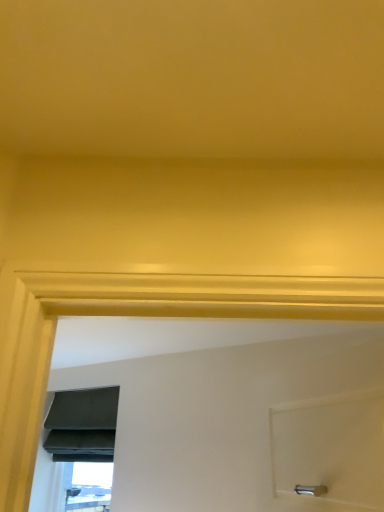
Question: Is matte gray fabric at lower left, which is the 1th window from top to bottom, positioned far away from matte black window at lower left, which is counted as the 2th window, starting from the top?

Choices:
 (A) yes
 (B) no

Answer: (B)

Question: Can you confirm if matte gray fabric at lower left, which is the 1th window from top to bottom, is bigger than matte black window at lower left, which is counted as the 2th window, starting from the top?

Choices:
 (A) yes
 (B) no

Answer: (A)

Question: From the image's perspective, would you say matte gray fabric at lower left, which is the second window from bottom to top, is shown under matte black window at lower left, which is counted as the 2th window, starting from the top?

Choices:
 (A) no
 (B) yes

Answer: (A)

Question: From a real-world perspective, is matte gray fabric at lower left, which is the second window from bottom to top, positioned over matte black window at lower left, the 1th window in the bottom-to-top sequence, based on gravity?

Choices:
 (A) yes
 (B) no

Answer: (A)

Question: Does matte gray fabric at lower left, which is the second window from bottom to top, have a lesser width compared to matte black window at lower left, which is counted as the 2th window, starting from the top?

Choices:
 (A) yes
 (B) no

Answer: (B)

Question: Can you confirm if matte gray fabric at lower left, which is the second window from bottom to top, is positioned to the right of matte black window at lower left, which is counted as the 2th window, starting from the top?

Choices:
 (A) no
 (B) yes

Answer: (A)

Question: Is matte gray fabric at lower left, which is the 1th window from top to bottom, surrounded by matte black window at lower left, the 1th window in the bottom-to-top sequence?

Choices:
 (A) yes
 (B) no

Answer: (B)

Question: Are matte black window at lower left, the 1th window in the bottom-to-top sequence, and matte gray fabric at lower left, which is the 1th window from top to bottom, beside each other?

Choices:
 (A) yes
 (B) no

Answer: (B)

Question: From a real-world perspective, is matte black window at lower left, which is counted as the 2th window, starting from the top, physically below matte gray fabric at lower left, which is the 1th window from top to bottom?

Choices:
 (A) no
 (B) yes

Answer: (B)

Question: Is matte black window at lower left, which is counted as the 2th window, starting from the top, further to camera compared to matte gray fabric at lower left, which is the 1th window from top to bottom?

Choices:
 (A) yes
 (B) no

Answer: (A)

Question: Does matte black window at lower left, the 1th window in the bottom-to-top sequence, have a larger size compared to matte gray fabric at lower left, which is the second window from bottom to top?

Choices:
 (A) no
 (B) yes

Answer: (A)

Question: From the image's perspective, relative to matte gray fabric at lower left, which is the 1th window from top to bottom, is matte black window at lower left, the 1th window in the bottom-to-top sequence, above or below?

Choices:
 (A) above
 (B) below

Answer: (B)